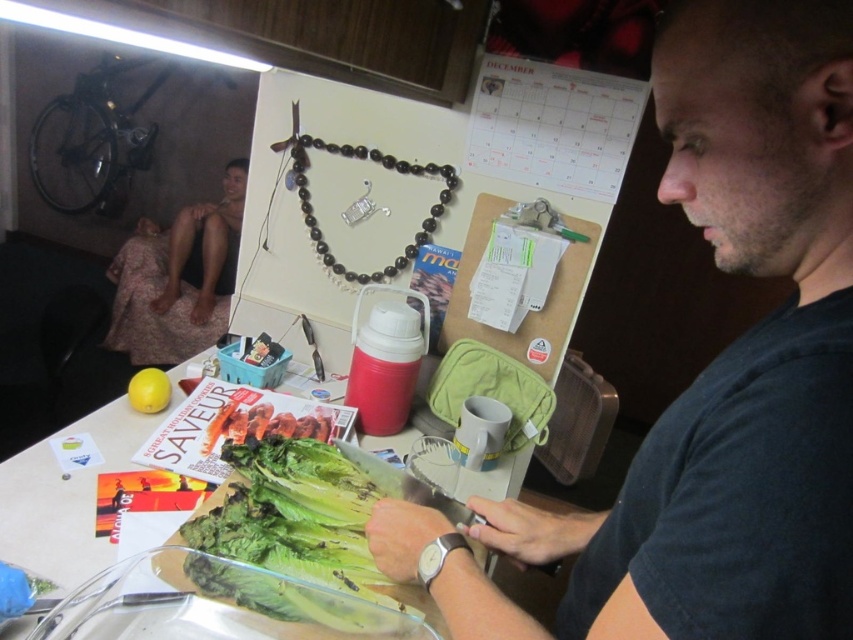
You are standing in the kitchen and want to reach both the point at coordinates point (364,554) and the point at coordinates point (328,252). Which point is closer to you?

The point at coordinates point (364,554) is closer to you than the point at coordinates point (328,252) because it is closer to the camera.

You are organizing a food preparation area and need to ensure that all items are visible. Given the dark gray shirt at center and the green leafy vegetable at lower center, which item takes up more space in the scene?

The dark gray shirt at center is bigger than the green leafy vegetable at lower center, so it takes up more space in the scene.